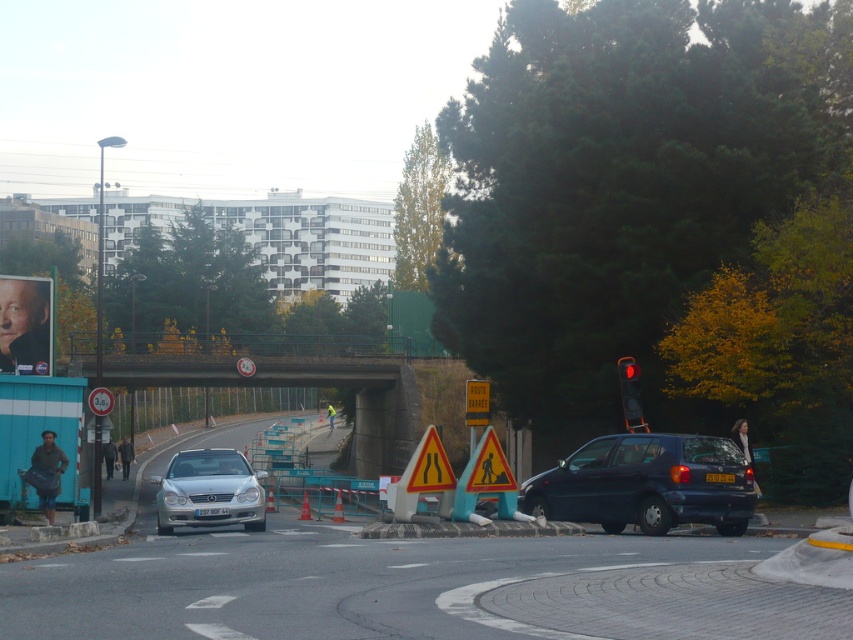
Question: Which point is farther from the camera taking this photo?

Choices:
 (A) (624, 385)
 (B) (666, 445)
 (C) (218, 493)

Answer: (A)

Question: Can you confirm if red glass traffic light at upper right is positioned below yellow reflective triangle at center?

Choices:
 (A) no
 (B) yes

Answer: (A)

Question: Is red glass traffic light at upper right to the right of yellow reflective triangle at center from the viewer's perspective?

Choices:
 (A) yes
 (B) no

Answer: (A)

Question: Which point is closer to the camera taking this photo?

Choices:
 (A) (622, 516)
 (B) (364, 380)
 (C) (486, 385)
 (D) (622, 404)

Answer: (A)

Question: Which point is closer to the camera taking this photo?

Choices:
 (A) (207, 355)
 (B) (469, 417)
 (C) (93, 397)
 (D) (738, 500)

Answer: (D)

Question: Observing the image, what is the correct spatial positioning of concrete bridge at center in reference to red glass traffic light at upper right?

Choices:
 (A) below
 (B) above

Answer: (A)